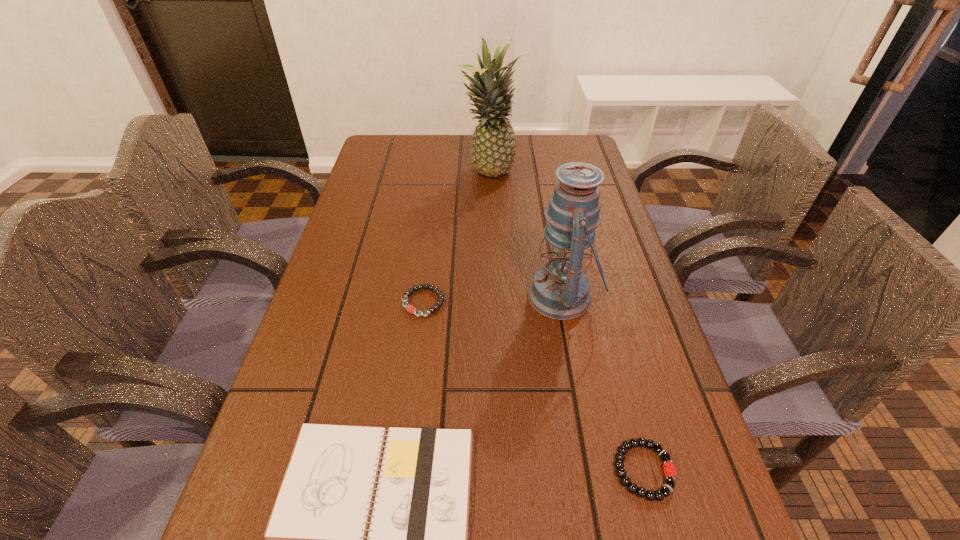
I want to click on object at the far edge, so click(x=493, y=150).

At what (x,y) coordinates should I click in order to perform the action: click on lantern situated at the right edge. Please return your answer as a coordinate pair (x, y). Image resolution: width=960 pixels, height=540 pixels. Looking at the image, I should click on (560, 290).

Identify the location of bracelet located in the right edge section of the desktop. This screenshot has width=960, height=540. click(669, 470).

This screenshot has height=540, width=960. In order to click on vacant space at the far edge of the desktop in this screenshot , I will do `click(537, 170)`.

Where is `blank space at the left edge of the desktop`? blank space at the left edge of the desktop is located at coordinates (376, 221).

Where is `vacant space at the right edge`? vacant space at the right edge is located at coordinates (622, 267).

You are a GUI agent. You are given a task and a screenshot of the screen. Output one action in this format:
    pyautogui.click(x=<x>, y=<y>)
    Task: Click on the vacant point at the far left corner
    The width and height of the screenshot is (960, 540).
    Given the screenshot: What is the action you would take?
    pyautogui.click(x=382, y=137)

Find the location of a particular element. This screenshot has width=960, height=540. vacant position at the far right corner of the desktop is located at coordinates (562, 151).

Find the location of a particular element. vacant area between the farthest object and the fourth shortest object is located at coordinates tap(525, 235).

Where is `vacant area that lies between the farther bracelet and the nearer bracelet`? vacant area that lies between the farther bracelet and the nearer bracelet is located at coordinates (534, 386).